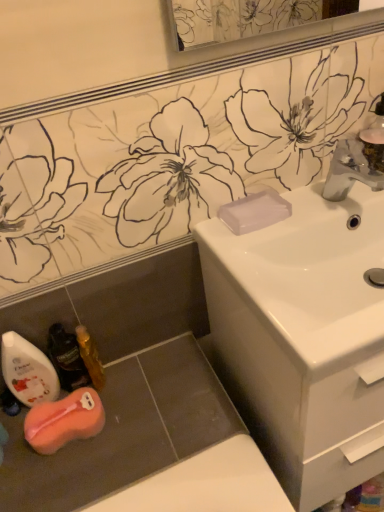
Find the location of `empty space that is in between transparent plastic soap at sink right and satin nickel faucet at upper right`. empty space that is in between transparent plastic soap at sink right and satin nickel faucet at upper right is located at coordinates coord(300,211).